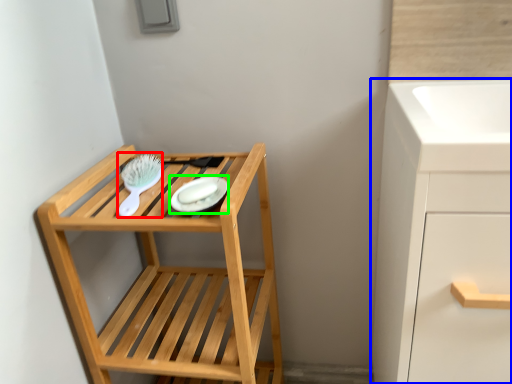
Question: Considering the real-world distances, which object is farthest from brush (highlighted by a red box)? bathroom cabinet (highlighted by a blue box) or platter (highlighted by a green box)?

Choices:
 (A) bathroom cabinet
 (B) platter

Answer: (A)